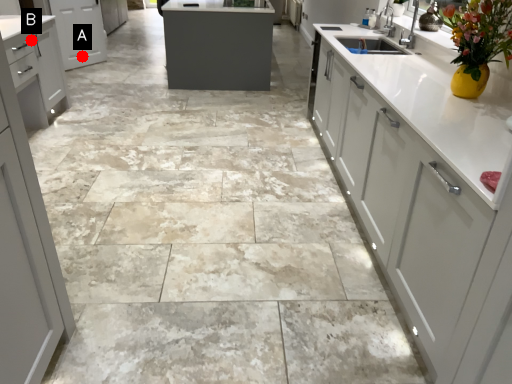
Question: Two points are circled on the image, labeled by A and B beside each circle. Among these points, which one is farthest from the camera?

Choices:
 (A) A is further
 (B) B is further

Answer: (A)